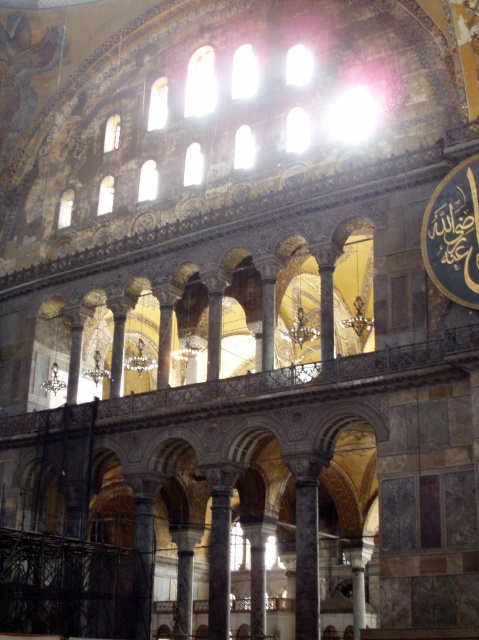
You are an architect visiting this historical building. You need to install a new lighting fixture that requires a distance of at least 20 meters between the gold metallic clock at upper right and the polished marble column at center. Is the current distance sufficient?

The gold metallic clock at upper right is 22.71 meters from the polished marble column at center, which exceeds the required 20 meters distance. Therefore, the current distance is sufficient for installing the new lighting fixture.